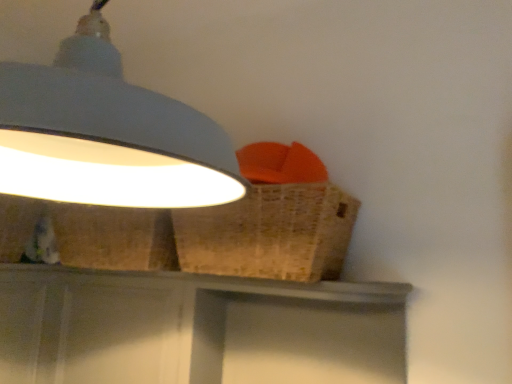
Question: From the image's perspective, is white matte lampshade at upper left beneath woven brown basket at upper right?

Choices:
 (A) no
 (B) yes

Answer: (A)

Question: Does white matte lampshade at upper left have a greater height compared to woven brown basket at upper right?

Choices:
 (A) yes
 (B) no

Answer: (A)

Question: From the image's perspective, is white matte lampshade at upper left above woven brown basket at upper right?

Choices:
 (A) no
 (B) yes

Answer: (B)

Question: From a real-world perspective, is white matte lampshade at upper left positioned over woven brown basket at upper right based on gravity?

Choices:
 (A) yes
 (B) no

Answer: (A)

Question: Is white matte lampshade at upper left oriented away from woven brown basket at upper right?

Choices:
 (A) no
 (B) yes

Answer: (A)

Question: Choose the correct answer: Is woven brown basket at upper right inside matte gray vanity at center or outside it?

Choices:
 (A) outside
 (B) inside

Answer: (A)

Question: Considering their positions, is woven brown basket at upper right located in front of or behind matte gray vanity at center?

Choices:
 (A) behind
 (B) front

Answer: (B)

Question: Is woven brown basket at upper right to the left or to the right of matte gray vanity at center in the image?

Choices:
 (A) right
 (B) left

Answer: (B)

Question: Considering the positions of woven brown basket at upper right and matte gray vanity at center in the image, is woven brown basket at upper right wider or thinner than matte gray vanity at center?

Choices:
 (A) wide
 (B) thin

Answer: (A)

Question: Is matte gray vanity at center inside or outside of white matte lampshade at upper left?

Choices:
 (A) outside
 (B) inside

Answer: (A)

Question: From the image's perspective, is matte gray vanity at center above or below white matte lampshade at upper left?

Choices:
 (A) below
 (B) above

Answer: (A)

Question: Does point (118, 339) appear closer or farther from the camera than point (64, 54)?

Choices:
 (A) farther
 (B) closer

Answer: (A)

Question: Based on their sizes in the image, would you say matte gray vanity at center is bigger or smaller than white matte lampshade at upper left?

Choices:
 (A) small
 (B) big

Answer: (A)

Question: From a real-world perspective, is white matte lampshade at upper left above or below woven brown basket at upper right?

Choices:
 (A) below
 (B) above

Answer: (B)

Question: Relative to woven brown basket at upper right, is white matte lampshade at upper left in front or behind?

Choices:
 (A) behind
 (B) front

Answer: (B)